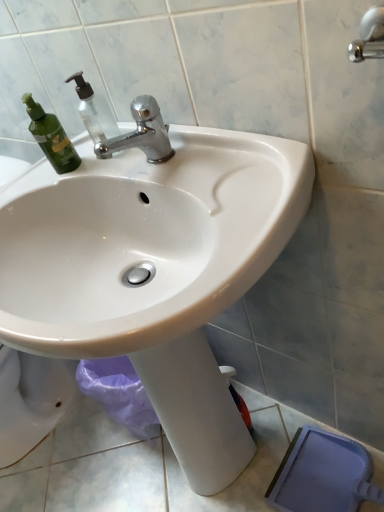
This screenshot has height=512, width=384. I want to click on vacant area that lies in front of transparent plastic soap dispenser at upper left, so click(x=145, y=176).